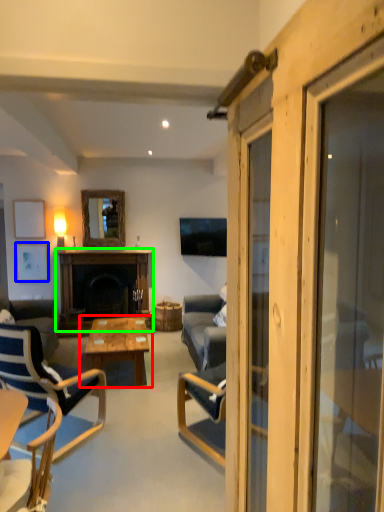
Question: Which is farther away from coffee table (highlighted by a red box)? picture frame (highlighted by a blue box) or fireplace (highlighted by a green box)?

Choices:
 (A) picture frame
 (B) fireplace

Answer: (A)